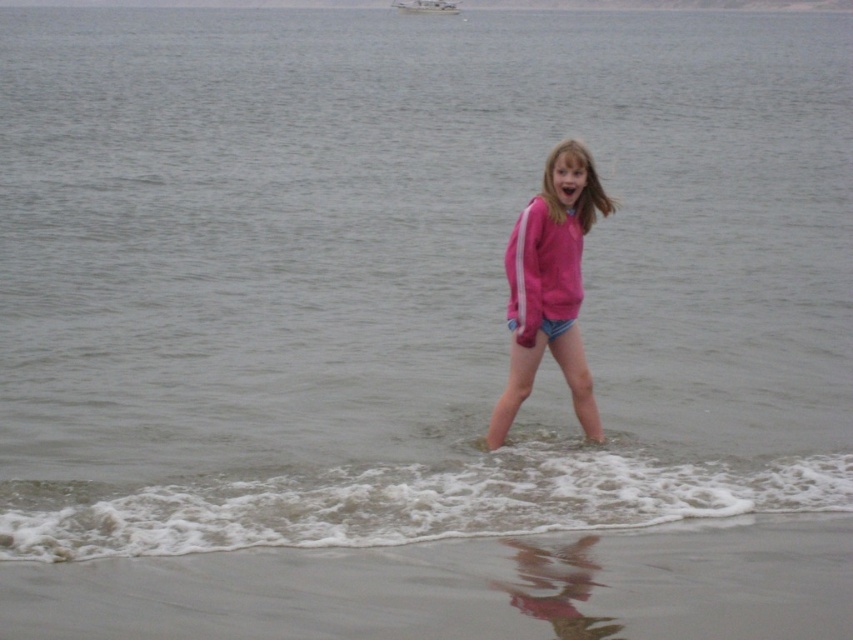
Question: Which point is closer to the camera?

Choices:
 (A) (553, 160)
 (B) (701, 563)
 (C) (436, 12)

Answer: (B)

Question: Among these points, which one is farthest from the camera?

Choices:
 (A) click(614, 570)
 (B) click(514, 294)

Answer: (B)

Question: In this image, where is sandy beach at lower center located relative to pink fabric shorts at center?

Choices:
 (A) left
 (B) right

Answer: (A)

Question: Is pink fabric shorts at center above white plastic boat at upper center?

Choices:
 (A) yes
 (B) no

Answer: (B)

Question: Is sandy beach at lower center positioned in front of white plastic boat at upper center?

Choices:
 (A) yes
 (B) no

Answer: (A)

Question: Which object is farther from the camera taking this photo?

Choices:
 (A) pink fabric shorts at center
 (B) sandy beach at lower center

Answer: (A)